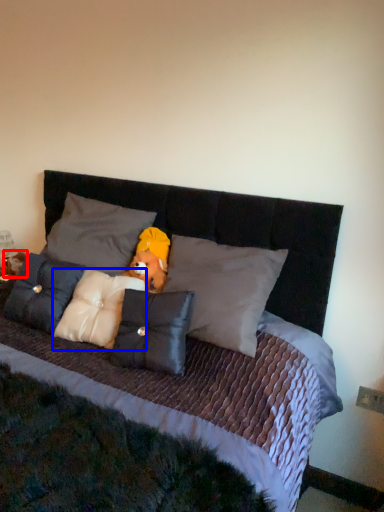
Question: Which point is closer to the camera, figurine (highlighted by a red box) or pillow (highlighted by a blue box)?

Choices:
 (A) figurine
 (B) pillow

Answer: (B)